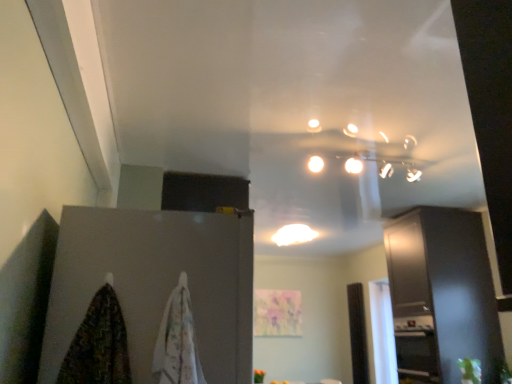
Question: In terms of size, does white glossy light fixture at center appear bigger or smaller than matte gray cabinet at left, the 1th cabinetry in the left-to-right sequence?

Choices:
 (A) small
 (B) big

Answer: (A)

Question: Is white glossy light fixture at center spatially inside matte gray cabinet at left, the first cabinetry positioned from the front, or outside of it?

Choices:
 (A) inside
 (B) outside

Answer: (B)

Question: Which object is the closest to the multicolored fabric at lower left, the first blanket positioned from the left?

Choices:
 (A) white glossy light fixture at center
 (B) white cotton towel at lower left, arranged as the second blanket when viewed from the left
 (C) matte gray cabinet at left, the second cabinetry positioned from the back
 (D) satin black cabinet at right, which is the 2th cabinetry from front to back

Answer: (B)

Question: Considering the real-world distances, which object is farthest from the matte gray cabinet at left, arranged as the second cabinetry when viewed from the right?

Choices:
 (A) multicolored fabric at lower left, which is the second blanket in right-to-left order
 (B) white glossy light fixture at center
 (C) satin black cabinet at right, the second cabinetry when ordered from left to right
 (D) white cotton towel at lower left, which appears as the 1th blanket when viewed from the right

Answer: (B)